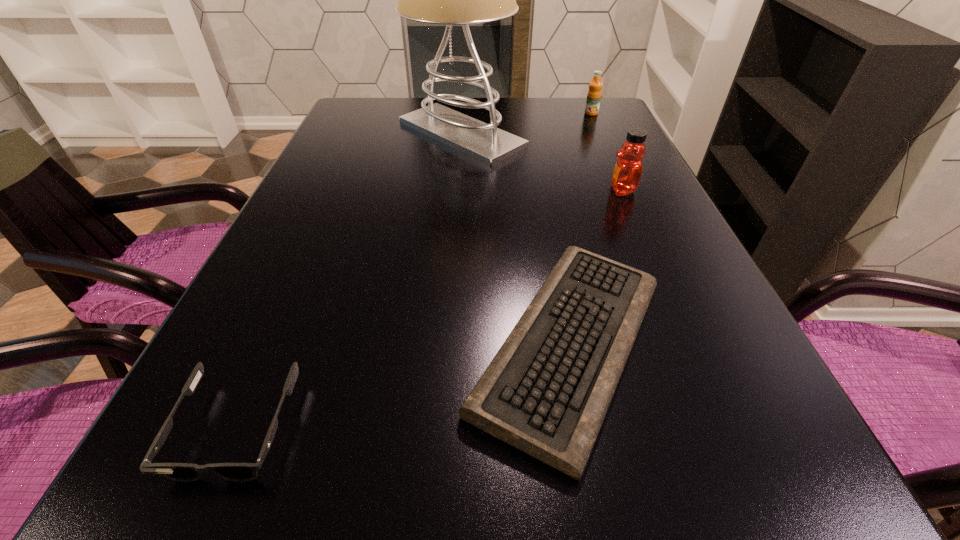
Locate an element on the screen. The height and width of the screenshot is (540, 960). vacant area situated on the label of the third shortest object is located at coordinates (598, 128).

Identify the location of vacant space located 0.210m on the left of the computer keyboard. (327, 345).

Identify the location of table lamp situated at the far edge. The height and width of the screenshot is (540, 960). (449, 0).

Locate an element on the screen. The width and height of the screenshot is (960, 540). orange juice located at the far edge is located at coordinates (594, 93).

Identify the location of sunglasses that is at the near edge. (182, 472).

This screenshot has width=960, height=540. What are the coordinates of `computer keyboard that is positioned at the near edge` in the screenshot? It's located at [x=546, y=392].

The height and width of the screenshot is (540, 960). What are the coordinates of `object that is at the left edge` in the screenshot? It's located at (182, 472).

The width and height of the screenshot is (960, 540). What are the coordinates of `honey that is at the right edge` in the screenshot? It's located at (626, 177).

Find the location of a particular element. The width and height of the screenshot is (960, 540). orange juice present at the right edge is located at coordinates (594, 93).

I want to click on computer keyboard that is at the right edge, so click(546, 392).